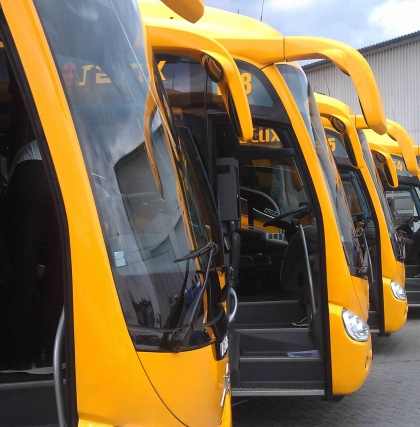
Find the location of `lights`. lights is located at coordinates (364, 327), (400, 293).